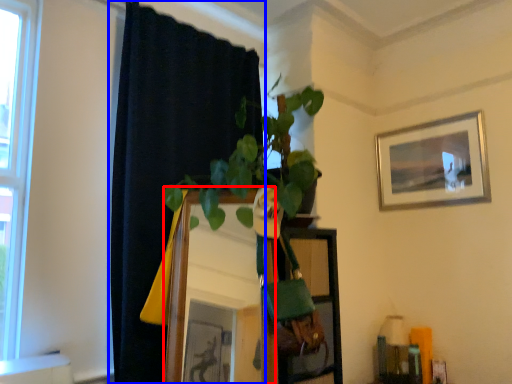
Question: Which object appears farthest to the camera in this image, mirror (highlighted by a red box) or curtain (highlighted by a blue box)?

Choices:
 (A) mirror
 (B) curtain

Answer: (B)